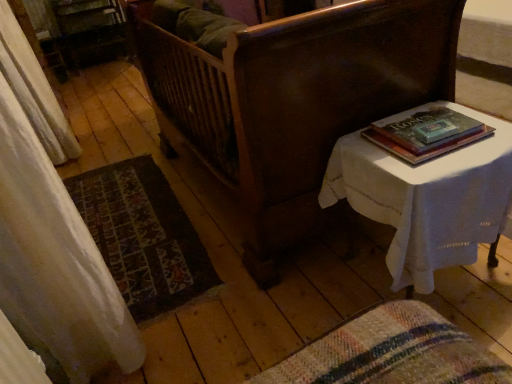
Identify the location of empty space that is ontop of white cloth-covered table at right (from a real-world perspective). (438, 150).